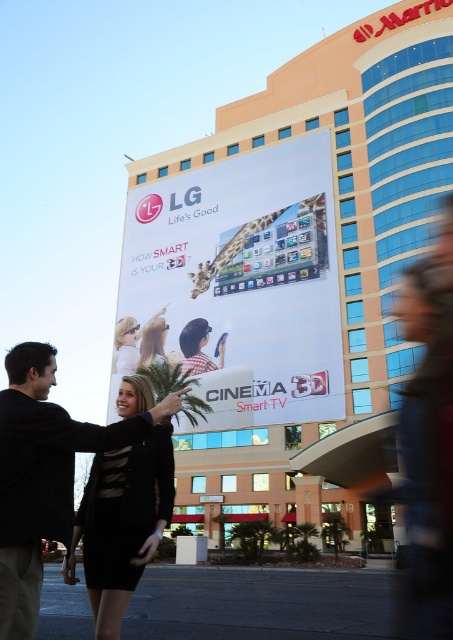
Is beige glass building at upper center to the right of blonde hair at upper left from the viewer's perspective?

Correct, you'll find beige glass building at upper center to the right of blonde hair at upper left.

Can you confirm if beige glass building at upper center is positioned below blonde hair at upper left?

Actually, beige glass building at upper center is above blonde hair at upper left.

Is point (188, 483) positioned behind point (115, 346)?

No, it is in front of (115, 346).

Find the location of a particular element. This screenshot has height=640, width=453. beige glass building at upper center is located at coordinates (295, 259).

Which is above, black matte suit at center or light brown hair at center?

light brown hair at center

Is point (62, 432) farther from viewer compared to point (141, 349)?

That is False.

Is point (67, 540) behind point (164, 355)?

No, (67, 540) is in front of (164, 355).

Find the location of a particular element. This screenshot has width=453, height=640. black matte suit at center is located at coordinates (43, 476).

Looking at this image, measure the distance from blonde hair at upper left to light brown hair at center.

A distance of 3.34 meters exists between blonde hair at upper left and light brown hair at center.

Does point (134, 323) come in front of point (154, 336)?

No, it is not.

The image size is (453, 640). What do you see at coordinates (125, 344) in the screenshot? I see `blonde hair at upper left` at bounding box center [125, 344].

Image resolution: width=453 pixels, height=640 pixels. Identify the location of blonde hair at upper left. (125, 344).